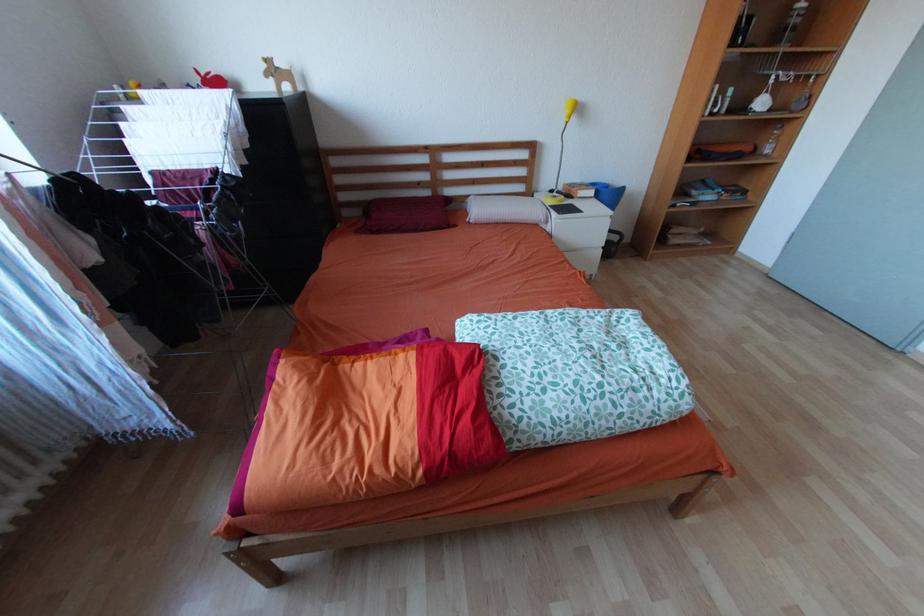
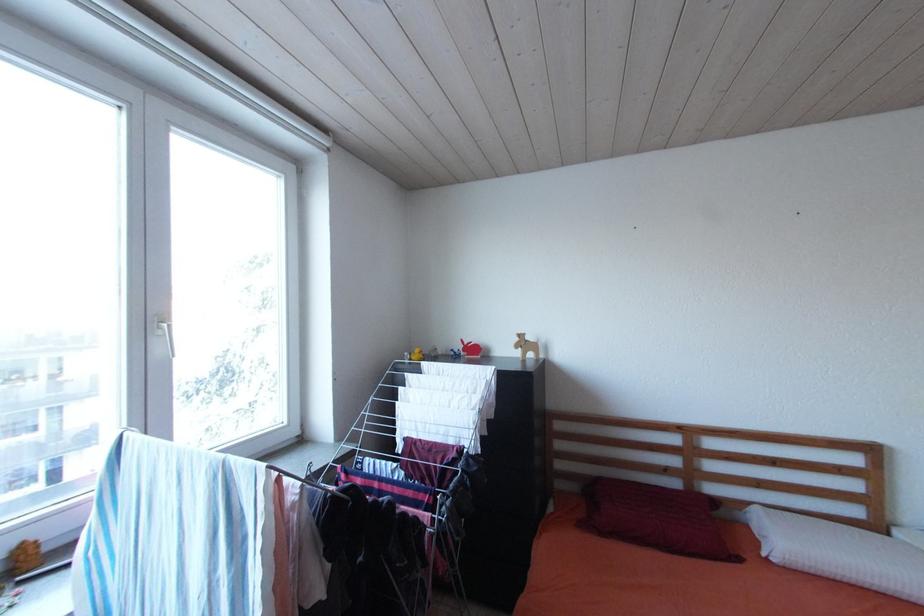
The first image is from the beginning of the video and the second image is from the end. How did the camera likely rotate when shooting the video?

The camera's rotation is toward left-up.